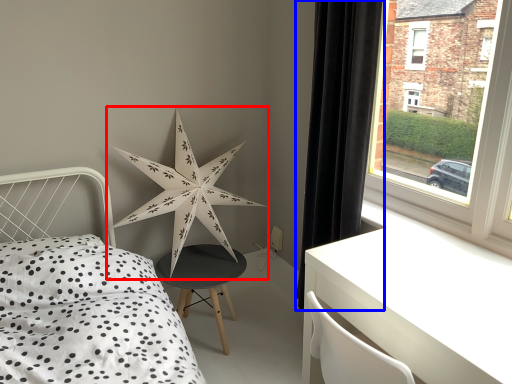
Question: Which point is closer to the camera, star (highlighted by a red box) or curtain (highlighted by a blue box)?

Choices:
 (A) star
 (B) curtain

Answer: (B)